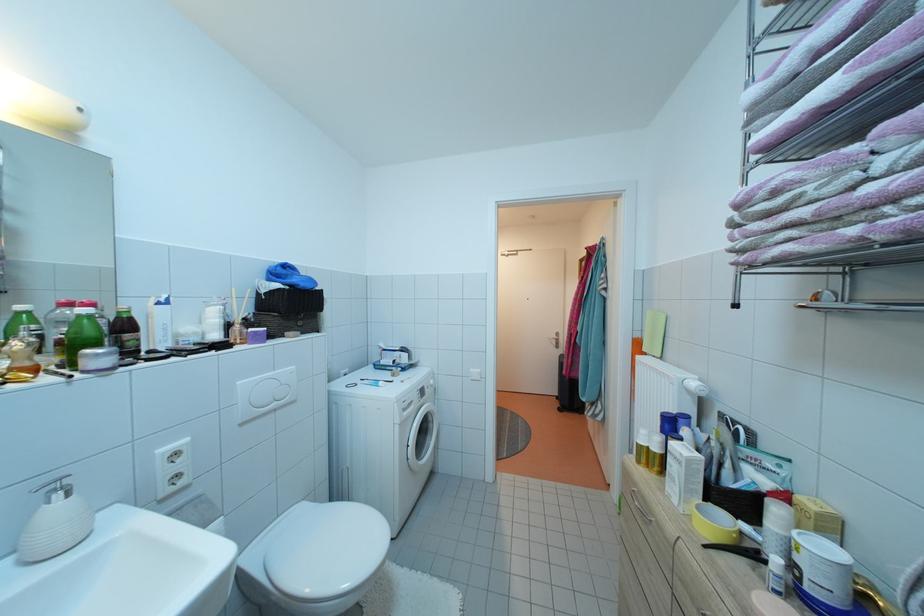
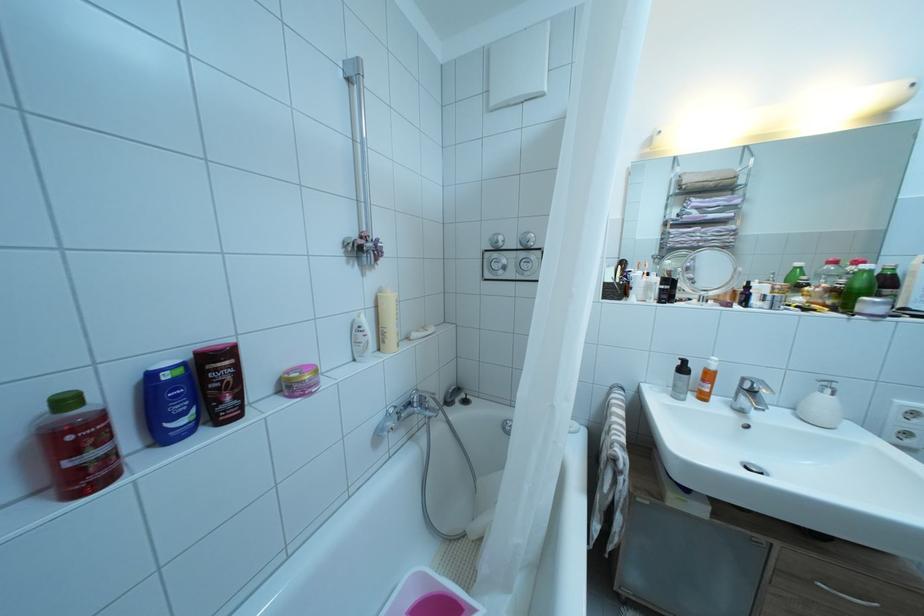
Question: How did the camera likely rotate?

Choices:
 (A) Left
 (B) Right
 (C) Up
 (D) Down

Answer: (A)